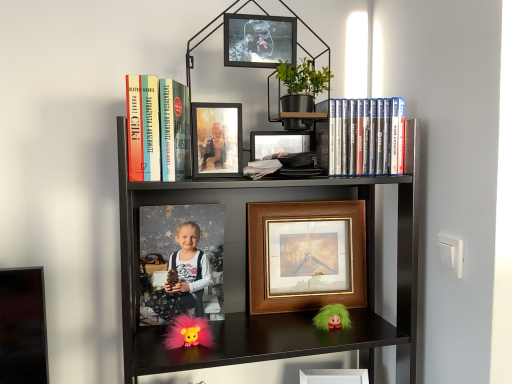
Question: Should I look upward or downward to see hardcover book at upper left, which ranks as the second book in right-to-left order?

Choices:
 (A) down
 (B) up

Answer: (B)

Question: Considering the relative sizes of matte wooden photo frame at upper center, positioned as the third picture frame in bottom-to-top order, and metallic photo frame at upper center, the 4th picture frame in the bottom-to-top sequence, in the image provided, is matte wooden photo frame at upper center, positioned as the third picture frame in bottom-to-top order, taller than metallic photo frame at upper center, the 4th picture frame in the bottom-to-top sequence,?

Choices:
 (A) yes
 (B) no

Answer: (A)

Question: From the image's perspective, is matte wooden photo frame at upper center, positioned as the third picture frame in bottom-to-top order, located beneath metallic photo frame at upper center, which is the 4th picture frame in back-to-front order?

Choices:
 (A) no
 (B) yes

Answer: (B)

Question: Considering the relative sizes of matte wooden photo frame at upper center, which is the 3th picture frame in back-to-front order, and metallic photo frame at upper center, which is the first picture frame in top-to-bottom order, in the image provided, is matte wooden photo frame at upper center, which is the 3th picture frame in back-to-front order, bigger than metallic photo frame at upper center, which is the first picture frame in top-to-bottom order,?

Choices:
 (A) yes
 (B) no

Answer: (B)

Question: Is matte wooden photo frame at upper center, acting as the 2th picture frame starting from the front, thinner than metallic photo frame at upper center, which is the 4th picture frame in back-to-front order?

Choices:
 (A) yes
 (B) no

Answer: (A)

Question: Does matte wooden photo frame at upper center, positioned as the third picture frame in bottom-to-top order, appear on the left side of metallic photo frame at upper center, which is the 4th picture frame in back-to-front order?

Choices:
 (A) no
 (B) yes

Answer: (B)

Question: Is matte wooden photo frame at upper center, which is the 3th picture frame in back-to-front order, positioned behind metallic photo frame at upper center, which is the 4th picture frame in back-to-front order?

Choices:
 (A) yes
 (B) no

Answer: (A)

Question: Can wooden picture frame at lower center, the 3th picture frame viewed from the front, be found inside matte plastic dvds at upper right, which is the first book in right-to-left order?

Choices:
 (A) no
 (B) yes

Answer: (A)

Question: Is matte plastic dvds at upper right, which is the first book in right-to-left order, smaller than wooden picture frame at lower center, positioned as the fourth picture frame in top-to-bottom order?

Choices:
 (A) yes
 (B) no

Answer: (A)

Question: Could you tell me if matte plastic dvds at upper right, which is the second book in left-to-right order, is turned towards wooden picture frame at lower center, the second picture frame when ordered from back to front?

Choices:
 (A) no
 (B) yes

Answer: (A)

Question: Can you confirm if matte plastic dvds at upper right, which is the first book in right-to-left order, is taller than wooden picture frame at lower center, arranged as the 1th picture frame when ordered from the bottom?

Choices:
 (A) yes
 (B) no

Answer: (B)

Question: Does matte plastic dvds at upper right, which is the first book in right-to-left order, appear on the right side of wooden picture frame at lower center, positioned as the fourth picture frame in top-to-bottom order?

Choices:
 (A) yes
 (B) no

Answer: (A)

Question: From a real-world perspective, is matte plastic dvds at upper right, which is the first book in right-to-left order, positioned under wooden picture frame at lower center, positioned as the fourth picture frame in top-to-bottom order, based on gravity?

Choices:
 (A) yes
 (B) no

Answer: (B)

Question: Is metallic photo frame at upper center, the 4th picture frame in the bottom-to-top sequence, facing away from fuzzy pink doll at lower center?

Choices:
 (A) no
 (B) yes

Answer: (A)